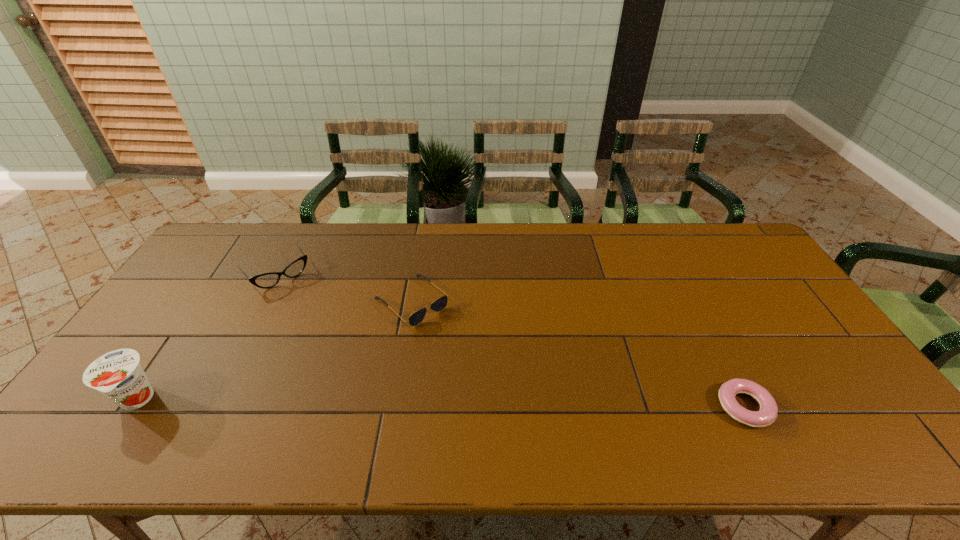
You are a GUI agent. You are given a task and a screenshot of the screen. Output one action in this format:
    pyautogui.click(x=<x>, y=<y>)
    Task: Click on the vacant area situated 0.290m on the front-facing side of the third object from left to right
    Image resolution: width=960 pixels, height=540 pixels.
    Given the screenshot: What is the action you would take?
    pyautogui.click(x=505, y=384)

Find the location of `free region located 0.340m on the front-facing side of the third object from left to right`. free region located 0.340m on the front-facing side of the third object from left to right is located at coordinates (519, 397).

I want to click on free region located on the front-facing side of the third object from left to right, so click(x=460, y=344).

This screenshot has width=960, height=540. Find the location of `free space located on the front-facing side of the second tallest object`. free space located on the front-facing side of the second tallest object is located at coordinates (310, 315).

Where is `free space located 0.260m on the front-facing side of the second tallest object`? This screenshot has width=960, height=540. free space located 0.260m on the front-facing side of the second tallest object is located at coordinates (328, 338).

Locate an element on the screen. The width and height of the screenshot is (960, 540). vacant region located 0.330m on the front-facing side of the second tallest object is located at coordinates (340, 353).

Find the location of a particular element. object located in the far edge section of the desktop is located at coordinates [267, 280].

Identify the location of yogurt that is positioned at the near edge. (118, 375).

At what (x,y) coordinates should I click in order to perform the action: click on doughnut located in the near edge section of the desktop. Please return your answer as a coordinate pair (x, y). Looking at the image, I should click on (767, 414).

Where is `object that is positioned at the left edge`? The height and width of the screenshot is (540, 960). object that is positioned at the left edge is located at coordinates (118, 375).